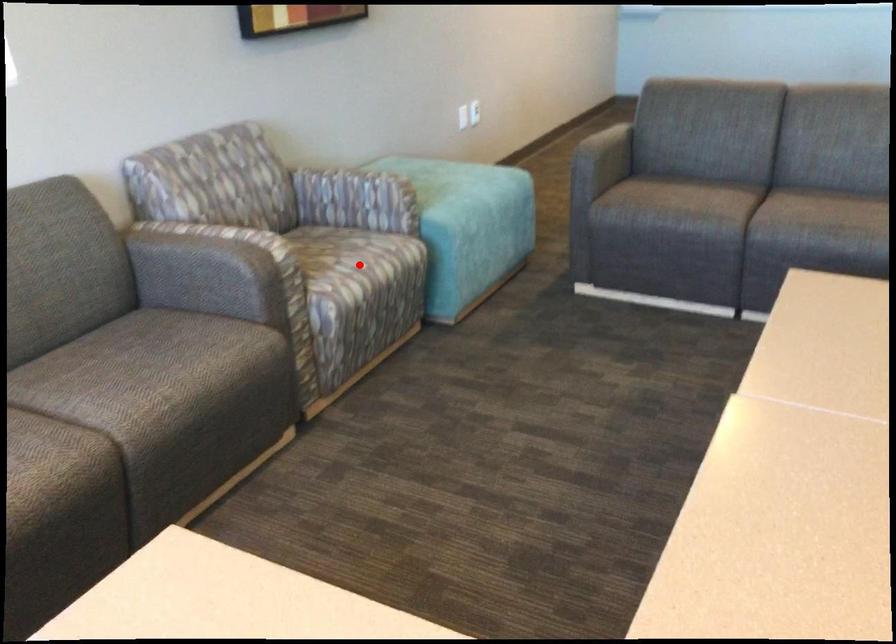
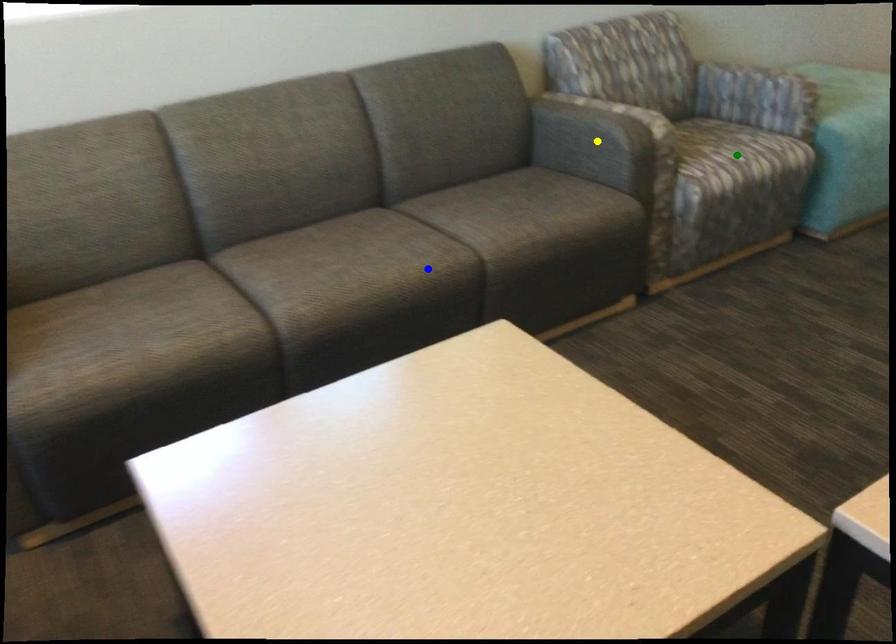
Question: I am providing you with two images of the same scene from different viewpoints. A red point is marked on the first image. You are given multiple points on the second image. Which point in image 2 is actually the same real-world point as the red point in image 1?

Choices:
 (A) green point
 (B) blue point
 (C) yellow point

Answer: (A)